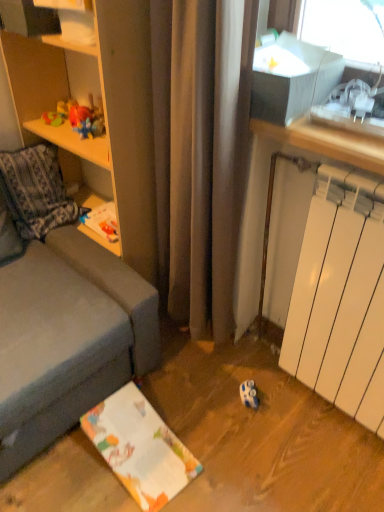
Question: Choose the correct answer: Is white glossy shelf at upper left inside white matte radiator at lower right or outside it?

Choices:
 (A) inside
 (B) outside

Answer: (B)

Question: From a real-world perspective, relative to white matte radiator at lower right, is white glossy shelf at upper left vertically above or below?

Choices:
 (A) below
 (B) above

Answer: (B)

Question: Which of these objects is positioned farthest from the wooden shelf at left?

Choices:
 (A) white glossy shelf at upper left
 (B) white matte radiator at lower right
 (C) plush orange bear at upper left

Answer: (B)

Question: Which is nearer to the wooden shelf at left?

Choices:
 (A) plush orange bear at upper left
 (B) white glossy shelf at upper left
 (C) white matte radiator at lower right

Answer: (A)